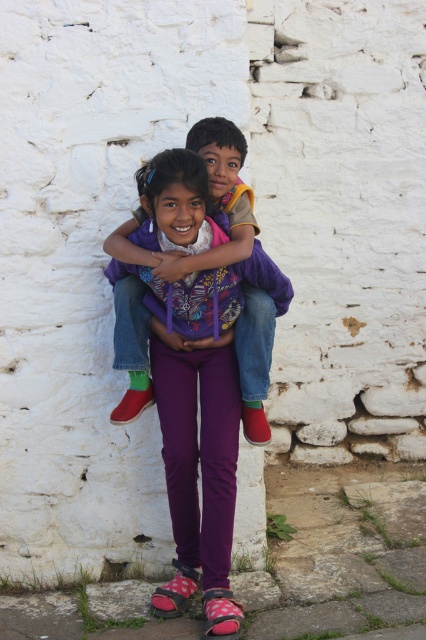
Question: Considering the relative positions of purple fleece jacket at center and purple fabric at center in the image provided, where is purple fleece jacket at center located with respect to purple fabric at center?

Choices:
 (A) below
 (B) above

Answer: (A)

Question: Considering the relative positions of purple fleece jacket at center and purple fabric at center in the image provided, where is purple fleece jacket at center located with respect to purple fabric at center?

Choices:
 (A) right
 (B) left

Answer: (B)

Question: Which of the following is the farthest from the observer?

Choices:
 (A) (141, 317)
 (B) (183, 256)

Answer: (A)

Question: Observing the image, what is the correct spatial positioning of purple fleece jacket at center in reference to purple fabric at center?

Choices:
 (A) left
 (B) right

Answer: (A)